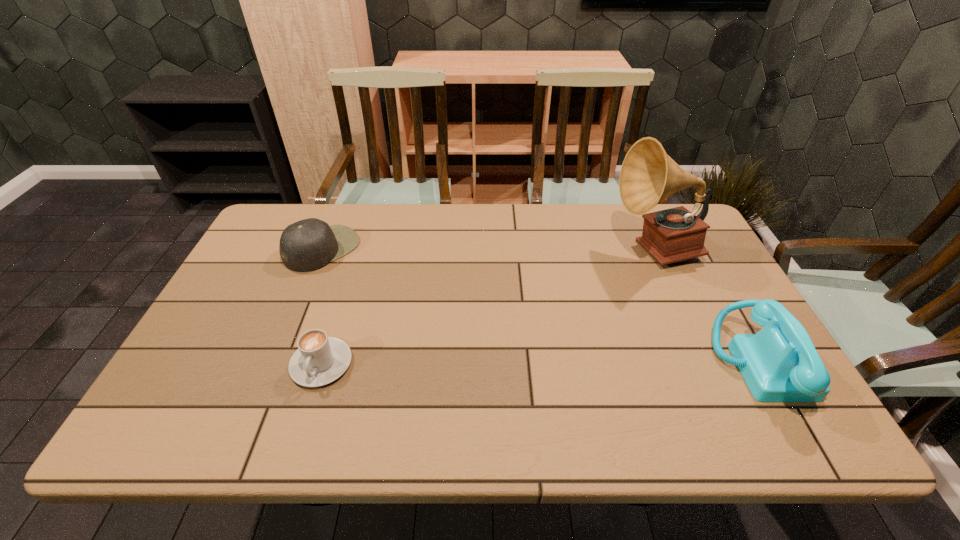
What are the coordinates of `vacant point at the far edge` in the screenshot? It's located at (363, 217).

I want to click on free region at the near edge of the desktop, so click(x=682, y=372).

The height and width of the screenshot is (540, 960). In the image, there is a desktop. What are the coordinates of `vacant space at the left edge` in the screenshot? It's located at (272, 256).

Locate an element on the screen. vacant area at the right edge of the desktop is located at coordinates (745, 324).

Find the location of `empty space that is in between the third shortest object and the shortest object`. empty space that is in between the third shortest object and the shortest object is located at coordinates (540, 363).

Where is `vacant point located between the cap and the shortest object`? vacant point located between the cap and the shortest object is located at coordinates (323, 306).

In order to click on blank region between the second tallest object and the cap in this screenshot , I will do `click(541, 306)`.

Where is `vacant area that lies between the shortest object and the tallest object`? This screenshot has width=960, height=540. vacant area that lies between the shortest object and the tallest object is located at coordinates (489, 307).

Find the location of a particular element. Image resolution: width=960 pixels, height=540 pixels. empty space between the cappuccino and the phonograph record is located at coordinates (489, 307).

At what (x,y) coordinates should I click in order to perform the action: click on empty location between the phonograph record and the cappuccino. Please return your answer as a coordinate pair (x, y). The image size is (960, 540). Looking at the image, I should click on (489, 307).